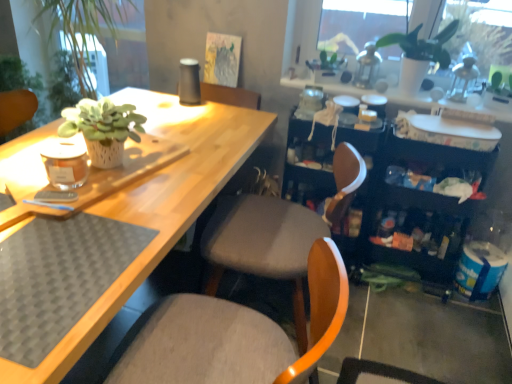
The width and height of the screenshot is (512, 384). What are the coordinates of `fabric cushioned chair at center, which appears as the 2th chair when viewed from the front` in the screenshot? It's located at (277, 234).

The image size is (512, 384). Describe the element at coordinates (277, 234) in the screenshot. I see `fabric cushioned chair at center, which appears as the 2th chair when viewed from the front` at that location.

Identify the location of matte gray cushioned chair at center, the 1th chair positioned from the front. The height and width of the screenshot is (384, 512). (233, 335).

Describe the element at coordinates (410, 193) in the screenshot. I see `black plastic bookshelf at right` at that location.

At what (x,y) coordinates should I click in order to perform the action: click on white matte plant pot at upper right. Please return your answer as a coordinate pair (x, y). This screenshot has height=384, width=512. Looking at the image, I should click on (419, 54).

Can we say fabric cushioned chair at center, the first chair in the back-to-front sequence, lies outside black plastic bookshelf at right?

Yes, fabric cushioned chair at center, the first chair in the back-to-front sequence, is located beyond the bounds of black plastic bookshelf at right.

Which object is thinner, fabric cushioned chair at center, the first chair in the back-to-front sequence, or black plastic bookshelf at right?

Thinner between the two is black plastic bookshelf at right.

Is fabric cushioned chair at center, the first chair in the back-to-front sequence, taller than black plastic bookshelf at right?

Yes.

Is the depth of fabric cushioned chair at center, which appears as the 2th chair when viewed from the front, greater than that of black plastic bookshelf at right?

No, it is not.

Is white matte plant pot at upper right not close to fabric cushioned chair at center, which appears as the 2th chair when viewed from the front?

No, white matte plant pot at upper right is not far from fabric cushioned chair at center, which appears as the 2th chair when viewed from the front.

Which is in front, white matte plant pot at upper right or fabric cushioned chair at center, the first chair in the back-to-front sequence?

fabric cushioned chair at center, the first chair in the back-to-front sequence, is more forward.

Which of these two, white matte plant pot at upper right or fabric cushioned chair at center, the first chair in the back-to-front sequence, is thinner?

Thinner between the two is white matte plant pot at upper right.

In the scene shown: Which of these two, white matte plant pot at upper right or black plastic bookshelf at right, stands taller?

With more height is black plastic bookshelf at right.

In the scene shown: Considering the sizes of objects white matte plant pot at upper right and black plastic bookshelf at right in the image provided, who is wider, white matte plant pot at upper right or black plastic bookshelf at right?

Wider between the two is black plastic bookshelf at right.

From a real-world perspective, is white matte plant pot at upper right positioned under black plastic bookshelf at right based on gravity?

No, from a real-world perspective, white matte plant pot at upper right is not beneath black plastic bookshelf at right.

Does white matte plant pot at upper right turn towards black plastic bookshelf at right?

No, white matte plant pot at upper right is not facing towards black plastic bookshelf at right.

Considering the relative sizes of black plastic bookshelf at right and matte gray cushioned chair at center, the 2th chair in the back-to-front sequence, in the image provided, is black plastic bookshelf at right shorter than matte gray cushioned chair at center, the 2th chair in the back-to-front sequence,?

Correct, black plastic bookshelf at right is not as tall as matte gray cushioned chair at center, the 2th chair in the back-to-front sequence.

Is black plastic bookshelf at right positioned with its back to matte gray cushioned chair at center, the 2th chair in the back-to-front sequence?

No, black plastic bookshelf at right is not facing away from matte gray cushioned chair at center, the 2th chair in the back-to-front sequence.

Based on the photo, is black plastic bookshelf at right next to matte gray cushioned chair at center, the 1th chair positioned from the front?

black plastic bookshelf at right and matte gray cushioned chair at center, the 1th chair positioned from the front, are not in contact.

Can you tell me how much black plastic bookshelf at right and matte gray cushioned chair at center, the 1th chair positioned from the front, differ in facing direction?

The angular difference between black plastic bookshelf at right and matte gray cushioned chair at center, the 1th chair positioned from the front, is 90.4 degrees.

Which of these two, matte gray cushioned chair at center, the 1th chair positioned from the front, or black plastic bookshelf at right, is smaller?

Smaller between the two is black plastic bookshelf at right.

Is matte gray cushioned chair at center, the 1th chair positioned from the front, in contact with black plastic bookshelf at right?

There is a gap between matte gray cushioned chair at center, the 1th chair positioned from the front, and black plastic bookshelf at right.

From a real-world perspective, is matte gray cushioned chair at center, the 1th chair positioned from the front, positioned above or below black plastic bookshelf at right?

Clearly, from a real-world perspective, matte gray cushioned chair at center, the 1th chair positioned from the front, is above black plastic bookshelf at right.

Does matte gray cushioned chair at center, the 2th chair in the back-to-front sequence, come behind black plastic bookshelf at right?

No.

From the picture: Can you tell me how much fabric cushioned chair at center, which appears as the 2th chair when viewed from the front, and matte gray cushioned chair at center, the 2th chair in the back-to-front sequence, differ in facing direction?

0.000263 degrees separate the facing orientations of fabric cushioned chair at center, which appears as the 2th chair when viewed from the front, and matte gray cushioned chair at center, the 2th chair in the back-to-front sequence.

Find the location of a particular element. The width and height of the screenshot is (512, 384). chair below the fabric cushioned chair at center, the first chair in the back-to-front sequence (from a real-world perspective) is located at coordinates (233, 335).

Relative to matte gray cushioned chair at center, the 1th chair positioned from the front, is fabric cushioned chair at center, which appears as the 2th chair when viewed from the front, in front or behind?

Clearly, fabric cushioned chair at center, which appears as the 2th chair when viewed from the front, is behind matte gray cushioned chair at center, the 1th chair positioned from the front.

Can you confirm if fabric cushioned chair at center, the first chair in the back-to-front sequence, is positioned to the left of matte gray cushioned chair at center, the 1th chair positioned from the front?

Incorrect, fabric cushioned chair at center, the first chair in the back-to-front sequence, is not on the left side of matte gray cushioned chair at center, the 1th chair positioned from the front.

Between white matte plant pot at upper right and matte gray cushioned chair at center, the 2th chair in the back-to-front sequence, which one has more height?

matte gray cushioned chair at center, the 2th chair in the back-to-front sequence.

Considering the positions of point (438, 41) and point (324, 346), is point (438, 41) closer or farther from the camera than point (324, 346)?

Point (438, 41) is farther from the camera than point (324, 346).

Does white matte plant pot at upper right appear on the left side of matte gray cushioned chair at center, the 1th chair positioned from the front?

No.

Consider the image. From a real-world perspective, does white matte plant pot at upper right stand above matte gray cushioned chair at center, the 1th chair positioned from the front?

Yes, from a real-world perspective, white matte plant pot at upper right is on top of matte gray cushioned chair at center, the 1th chair positioned from the front.

Identify the location of bookshelf lying on the right of fabric cushioned chair at center, which appears as the 2th chair when viewed from the front. (410, 193).

The image size is (512, 384). I want to click on the 1st chair in front of the white matte plant pot at upper right, counting from the anchor's position, so click(277, 234).

When comparing their distances from white matte plant pot at upper right, does matte gray cushioned chair at center, the 1th chair positioned from the front, or black plastic bookshelf at right seem closer?

black plastic bookshelf at right is closer to white matte plant pot at upper right.

Consider the image. Considering their positions, is white matte plant pot at upper right positioned closer to black plastic bookshelf at right than fabric cushioned chair at center, the first chair in the back-to-front sequence?

The object closer to black plastic bookshelf at right is fabric cushioned chair at center, the first chair in the back-to-front sequence.

Considering their positions, is fabric cushioned chair at center, the first chair in the back-to-front sequence, positioned further to white matte plant pot at upper right than black plastic bookshelf at right?

fabric cushioned chair at center, the first chair in the back-to-front sequence, is positioned further to the anchor white matte plant pot at upper right.

Estimate the real-world distances between objects in this image. Which object is further from white matte plant pot at upper right, fabric cushioned chair at center, the first chair in the back-to-front sequence, or matte gray cushioned chair at center, the 1th chair positioned from the front?

Based on the image, matte gray cushioned chair at center, the 1th chair positioned from the front, appears to be further to white matte plant pot at upper right.

Which object lies further to the anchor point fabric cushioned chair at center, which appears as the 2th chair when viewed from the front, matte gray cushioned chair at center, the 2th chair in the back-to-front sequence, or white matte plant pot at upper right?

white matte plant pot at upper right lies further to fabric cushioned chair at center, which appears as the 2th chair when viewed from the front, than the other object.

Which object lies nearer to the anchor point fabric cushioned chair at center, which appears as the 2th chair when viewed from the front, white matte plant pot at upper right or black plastic bookshelf at right?

black plastic bookshelf at right lies closer to fabric cushioned chair at center, which appears as the 2th chair when viewed from the front, than the other object.

Which object lies further to the anchor point black plastic bookshelf at right, matte gray cushioned chair at center, the 1th chair positioned from the front, or fabric cushioned chair at center, which appears as the 2th chair when viewed from the front?

Among the two, matte gray cushioned chair at center, the 1th chair positioned from the front, is located further to black plastic bookshelf at right.

When comparing their distances from black plastic bookshelf at right, does fabric cushioned chair at center, the first chair in the back-to-front sequence, or matte gray cushioned chair at center, the 1th chair positioned from the front, seem further?

matte gray cushioned chair at center, the 1th chair positioned from the front, lies further to black plastic bookshelf at right than the other object.

You are a GUI agent. You are given a task and a screenshot of the screen. Output one action in this format:
    pyautogui.click(x=<x>, y=<y>)
    Task: Click on the chair between white matte plant pot at upper right and matte gray cushioned chair at center, the 2th chair in the back-to-front sequence, from top to bottom
    The image size is (512, 384).
    Given the screenshot: What is the action you would take?
    pyautogui.click(x=277, y=234)

In order to click on bookshelf between white matte plant pot at upper right and fabric cushioned chair at center, which appears as the 2th chair when viewed from the front, vertically in this screenshot , I will do (x=410, y=193).

Find the location of a particular element. This screenshot has width=512, height=384. chair between matte gray cushioned chair at center, the 2th chair in the back-to-front sequence, and black plastic bookshelf at right in the front-back direction is located at coordinates (277, 234).

Locate an element on the screen. bookshelf between white matte plant pot at upper right and matte gray cushioned chair at center, the 1th chair positioned from the front, in the vertical direction is located at coordinates (410, 193).